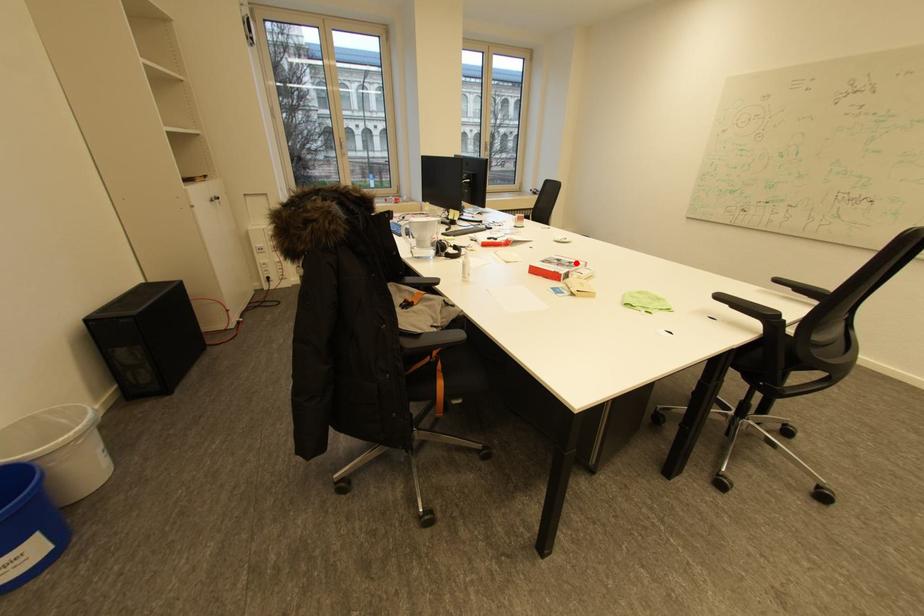
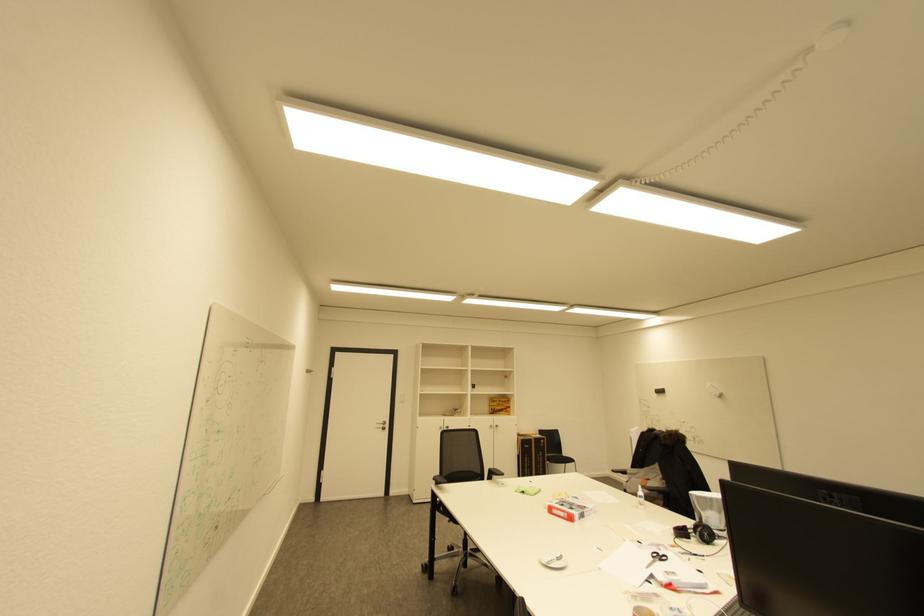
Question: I am providing you with two images of the same scene from different viewpoints. A red point is marked on the first image. At the location where the point appears in image 1, is it still visible in image 2?

Choices:
 (A) Yes
 (B) No

Answer: (A)